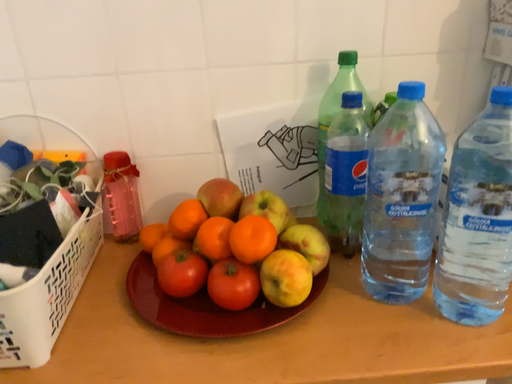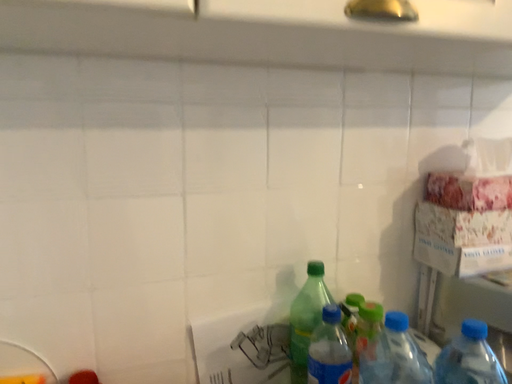
Question: How did the camera likely rotate when shooting the video?

Choices:
 (A) rotated left
 (B) rotated right

Answer: (B)